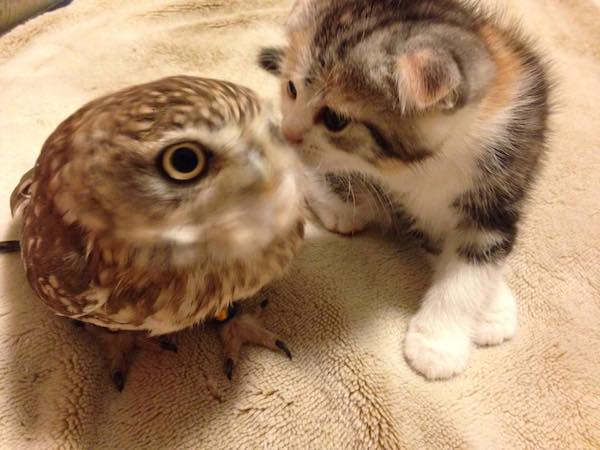
Identify the location of towel. (286, 388).